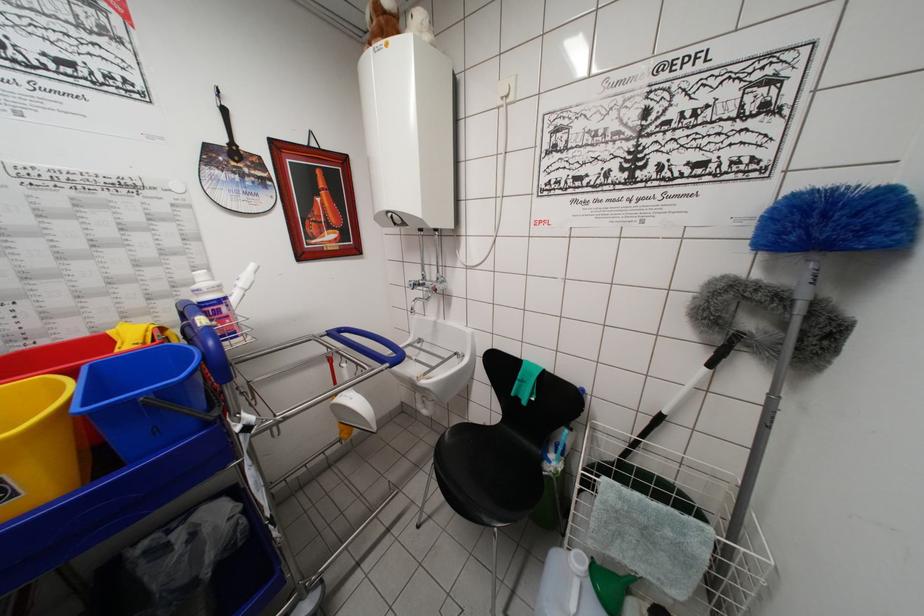
Find the location of a particular element. white cleaner bottle is located at coordinates (214, 304).